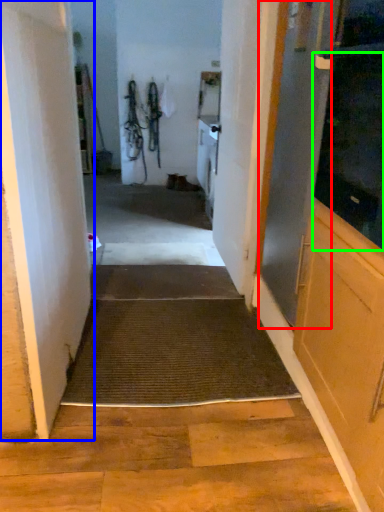
Question: Which object is the closest to the screen door (highlighted by a red box)? Choose among these: door (highlighted by a blue box) or screen door (highlighted by a green box).

Choices:
 (A) door
 (B) screen door

Answer: (B)